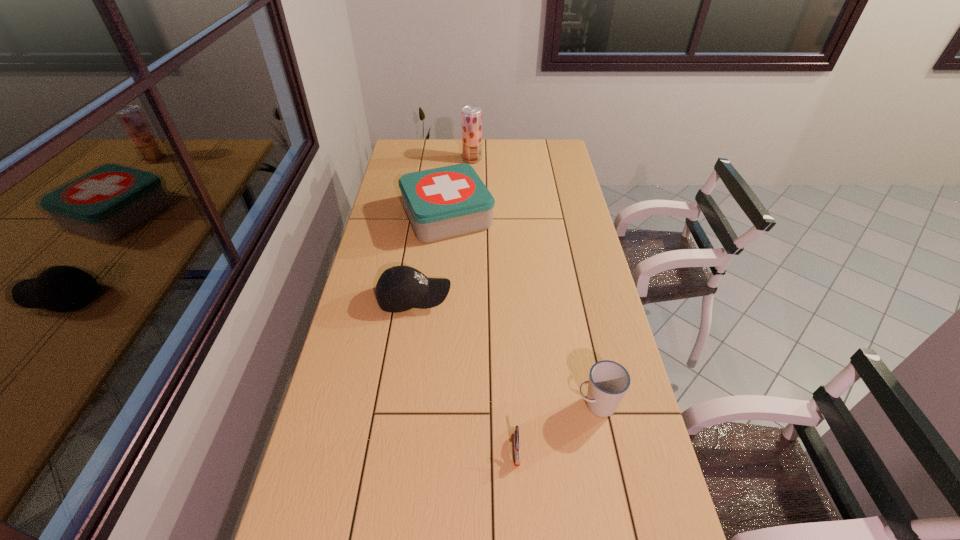
Locate an element on the screen. This screenshot has width=960, height=540. blank space located with a handle on the side of the rightmost object is located at coordinates point(468,404).

At what (x,y) coordinates should I click in order to perform the action: click on vacant point located 0.240m with a handle on the side of the rightmost object. Please return your answer as a coordinate pair (x, y). This screenshot has width=960, height=540. Looking at the image, I should click on click(490, 404).

Where is `vacant region located with a handle on the side of the rightmost object`? vacant region located with a handle on the side of the rightmost object is located at coordinates (558, 404).

Image resolution: width=960 pixels, height=540 pixels. I want to click on vacant space located 0.290m on the front-facing side of the baseball cap, so click(536, 298).

In order to click on blank space located on the handle side of the shortest object in this screenshot , I will do `click(520, 518)`.

Locate an element on the screen. object located at the far edge is located at coordinates (471, 115).

The image size is (960, 540). I want to click on the first-aid kit that is positioned at the left edge, so click(x=445, y=202).

The height and width of the screenshot is (540, 960). Identify the location of baseball cap that is at the left edge. (400, 288).

Find the location of a particular element. object that is at the right edge is located at coordinates 608,382.

Where is `blank space at the far edge of the desktop`? blank space at the far edge of the desktop is located at coordinates (483, 156).